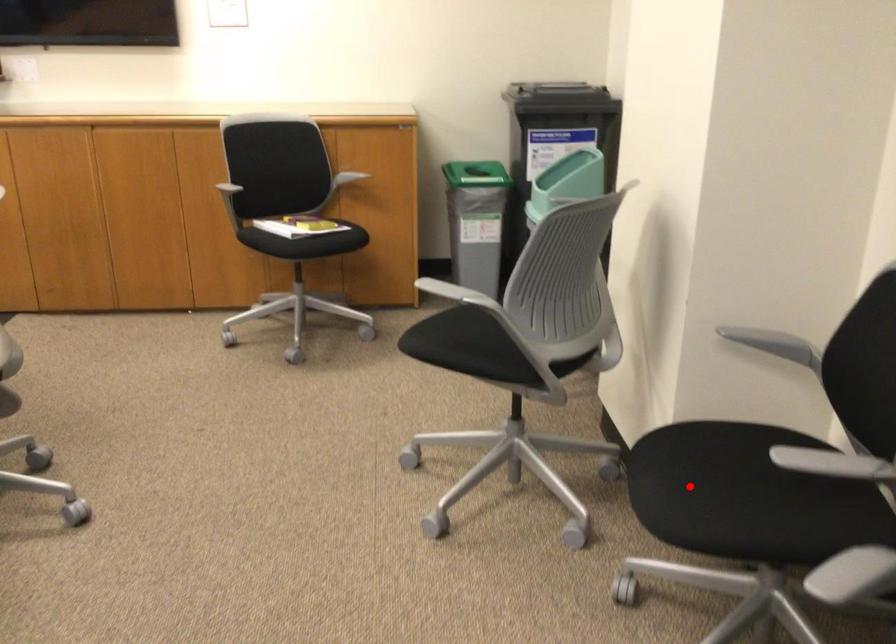
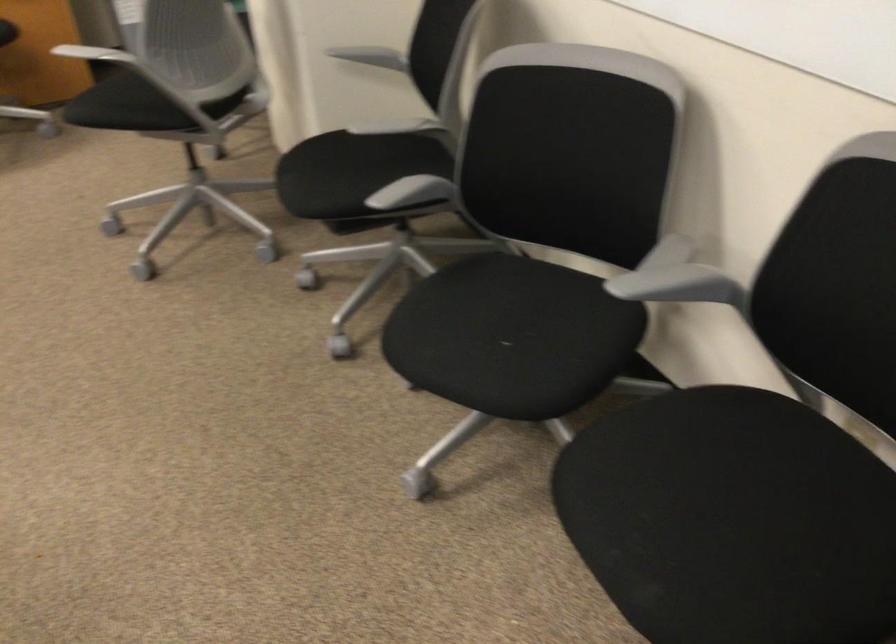
Where in the second image is the point corresponding to the highlighted location from the first image?

(319, 176)